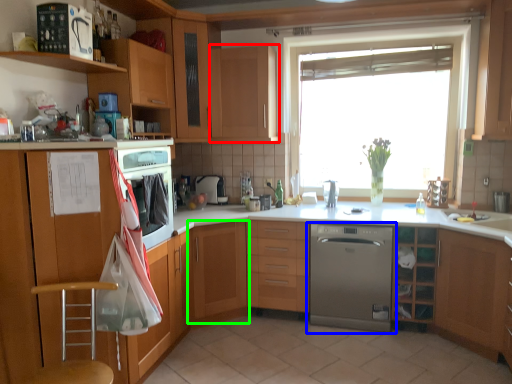
Question: Considering the real-world distances, which object is closest to cabinetry (highlighted by a red box)? home appliance (highlighted by a blue box) or cabinetry (highlighted by a green box).

Choices:
 (A) home appliance
 (B) cabinetry

Answer: (B)